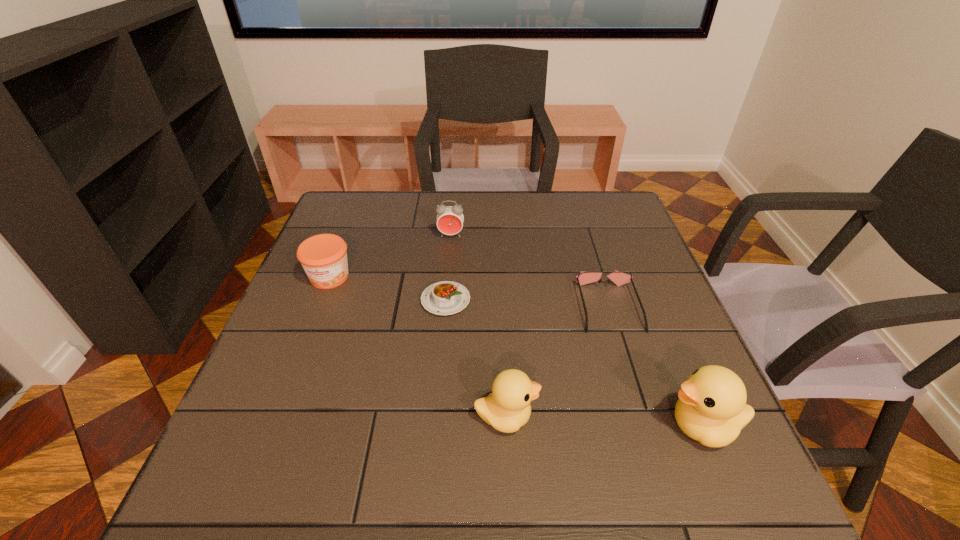
Locate an element on the screen. The image size is (960, 540). free space between the fourth object from left to right and the taller duck is located at coordinates (604, 422).

Image resolution: width=960 pixels, height=540 pixels. What are the coordinates of `free space between the sunglasses and the right duck` in the screenshot? It's located at [x=656, y=367].

At what (x,y) coordinates should I click in order to perform the action: click on unoccupied position between the left duck and the sunglasses. Please return your answer as a coordinate pair (x, y). Looking at the image, I should click on (558, 362).

This screenshot has height=540, width=960. In order to click on vacant space that's between the taller duck and the pudding in this screenshot , I will do `click(574, 363)`.

What are the coordinates of `free area in between the pudding and the taller duck` in the screenshot? It's located at (574, 363).

Locate an element on the screen. The image size is (960, 540). empty space that is in between the third shortest object and the farthest object is located at coordinates (390, 256).

Where is `vacant space that is in between the taller duck and the pudding`? This screenshot has width=960, height=540. vacant space that is in between the taller duck and the pudding is located at coordinates (574, 363).

Image resolution: width=960 pixels, height=540 pixels. Find the location of `free space between the shortest object and the jam`. free space between the shortest object and the jam is located at coordinates (388, 288).

At what (x,y) coordinates should I click in order to perform the action: click on object that is the fifth closest to the sunglasses. Please return your answer as a coordinate pair (x, y). Looking at the image, I should click on (323, 257).

In order to click on object that is the fourth closest to the shortest object in this screenshot , I will do (x=619, y=278).